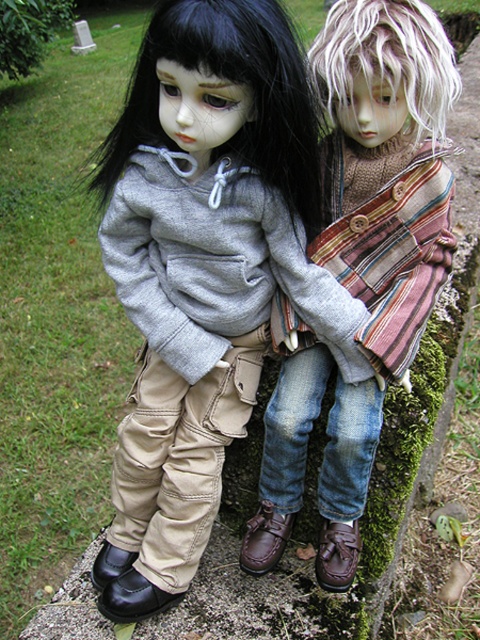
Is matte gray hoodie at center above striped woolen scarf at center?

No, matte gray hoodie at center is not above striped woolen scarf at center.

Image resolution: width=480 pixels, height=640 pixels. Describe the element at coordinates (203, 272) in the screenshot. I see `matte gray hoodie at center` at that location.

Describe the element at coordinates (203, 272) in the screenshot. Image resolution: width=480 pixels, height=640 pixels. I see `matte gray hoodie at center` at that location.

This screenshot has width=480, height=640. I want to click on matte gray hoodie at center, so click(203, 272).